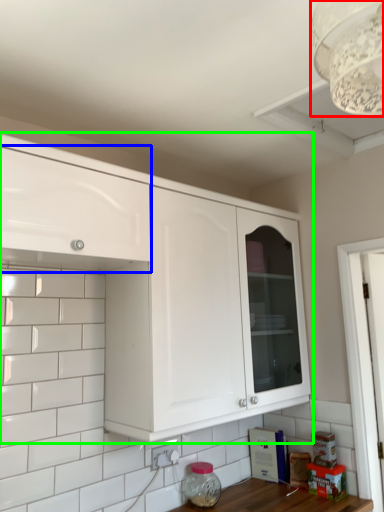
Question: Which is farther away from light fixture (highlighted by a red box)? cabinetry (highlighted by a blue box) or cabinetry (highlighted by a green box)?

Choices:
 (A) cabinetry
 (B) cabinetry

Answer: (B)